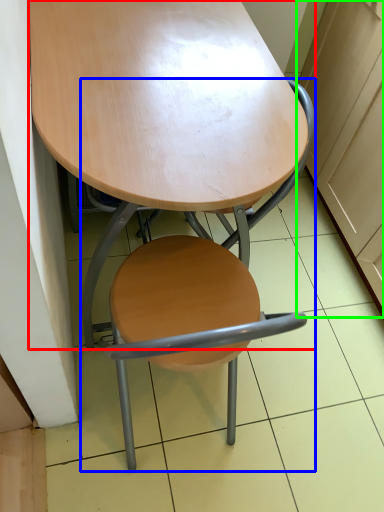
Question: Which object is positioned farthest from table (highlighted by a red box)? Select from chair (highlighted by a blue box) and cabinetry (highlighted by a green box).

Choices:
 (A) chair
 (B) cabinetry

Answer: (B)